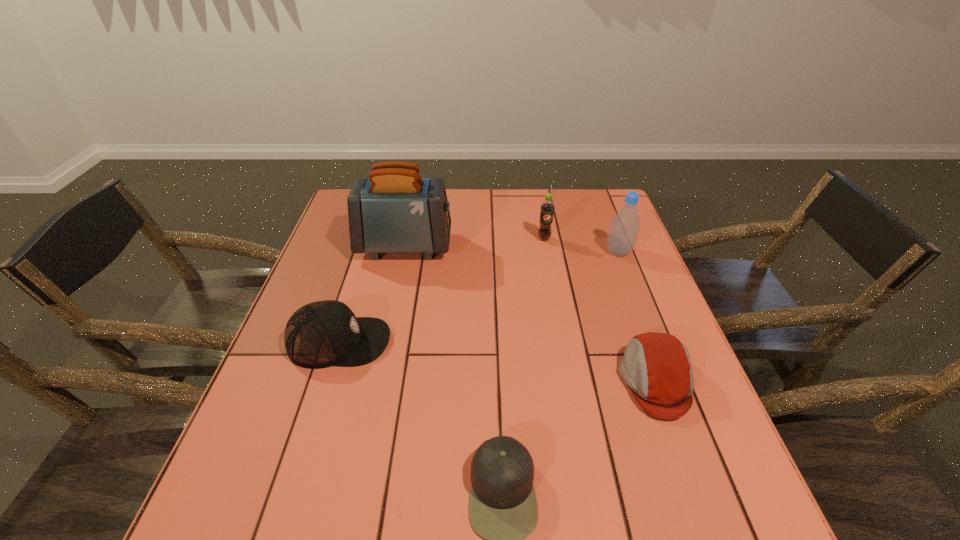
At what (x,y) coordinates should I click in order to perform the action: click on the tallest object. Please return your answer as a coordinate pair (x, y). This screenshot has width=960, height=540. Looking at the image, I should click on (395, 210).

This screenshot has height=540, width=960. What are the coordinates of `bottle` in the screenshot? It's located at (625, 225).

Locate an element on the screen. the third object from right to left is located at coordinates (547, 208).

In order to click on the fourth shortest object in this screenshot , I will do `click(547, 208)`.

At what (x,y) coordinates should I click in order to perform the action: click on the tallest cap. Please return your answer as a coordinate pair (x, y). The image size is (960, 540). Looking at the image, I should click on (320, 334).

Locate an element on the screen. the fourth tallest object is located at coordinates (320, 334).

Locate an element on the screen. This screenshot has width=960, height=540. the rightmost cap is located at coordinates (656, 367).

Locate an element on the screen. free space located 0.230m on the front-facing side of the tallest object is located at coordinates (530, 246).

You are a GUI agent. You are given a task and a screenshot of the screen. Output one action in this format:
    pyautogui.click(x=<x>, y=<y>)
    Task: Click on the free space located on the front of the fifth shortest object
    This screenshot has width=960, height=540.
    Given the screenshot: What is the action you would take?
    tap(632, 286)

Where is `free space located on the front label of the fourth shortest object`? This screenshot has height=540, width=960. free space located on the front label of the fourth shortest object is located at coordinates (560, 324).